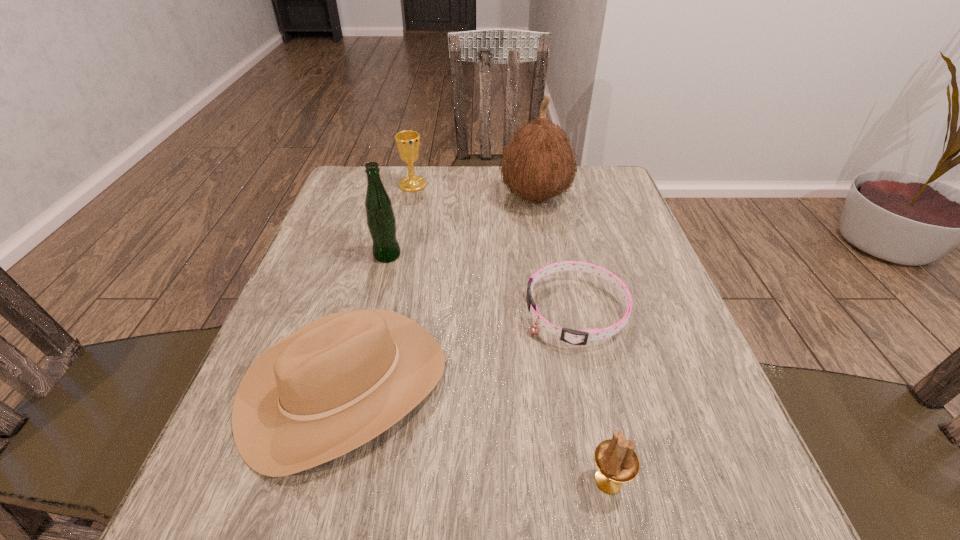
The image size is (960, 540). In the image, there is a desktop. In order to click on free region at the right edge in this screenshot , I will do `click(625, 211)`.

Where is `vacant area at the far right corner of the desktop`? vacant area at the far right corner of the desktop is located at coordinates (619, 185).

Identify the location of vacant region between the cowboy hat and the chalice. (379, 286).

I want to click on unoccupied area between the beer bottle and the tallest object, so click(461, 226).

In order to click on free space between the chalice and the dog collar in this screenshot , I will do `click(494, 248)`.

Find the location of a particular element. The width and height of the screenshot is (960, 540). free space between the shortest object and the chalice is located at coordinates click(494, 248).

Where is `free space between the candle holder and the dog collar`? free space between the candle holder and the dog collar is located at coordinates (592, 396).

Locate an element on the screen. The height and width of the screenshot is (540, 960). unoccupied position between the coconut and the chalice is located at coordinates (474, 191).

The width and height of the screenshot is (960, 540). I want to click on free spot between the shortest object and the candle holder, so pyautogui.click(x=592, y=396).

Find the location of a particular element. This screenshot has width=960, height=540. vacant point located between the chalice and the cowboy hat is located at coordinates (379, 286).